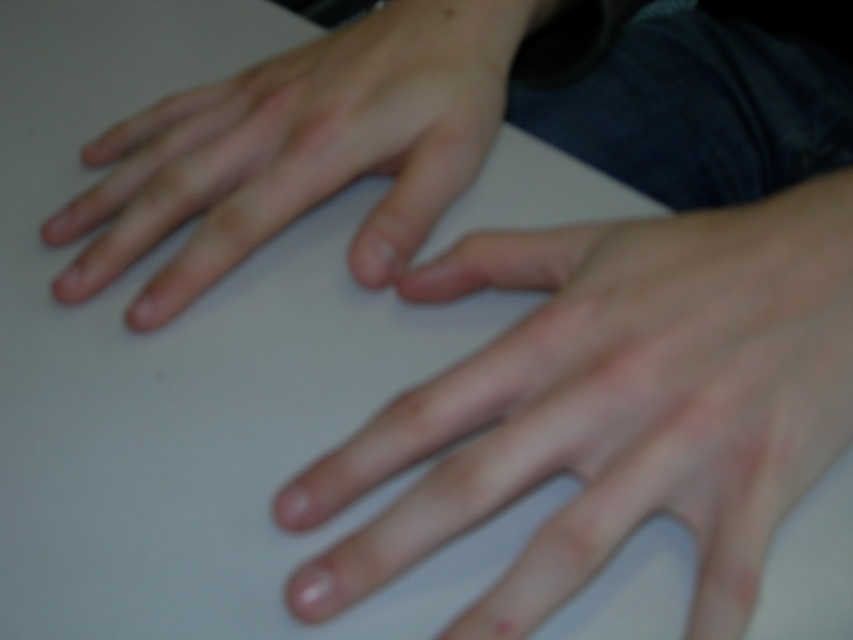
You are a robot trying to pick up an object placed exactly at point (618,445) and point (398,81). Which point should you move towards first to reach the object closest to you?

Point (618,445) is in front of point (398,81), so you should move towards point (618,445) first since it is closer to you.

You are a researcher analyzing hand positions in images. The image shows a smooth skin hand at center. Can you determine if the hand is positioned closer to the upper right corner of the image based on its coordinates?

The smooth skin hand at center is located at point (612, 404), which places it closer to the upper right corner of the image compared to the center point.

You are a dermatologist examining the image of two hands. You need to determine which hand is closer to the camera. Based on the height difference between the smooth skin hand at center and the smooth skin hand at upper left, which one is lower in the frame?

The smooth skin hand at center has a lesser height compared to the smooth skin hand at upper left, so the smooth skin hand at center is lower in the frame.